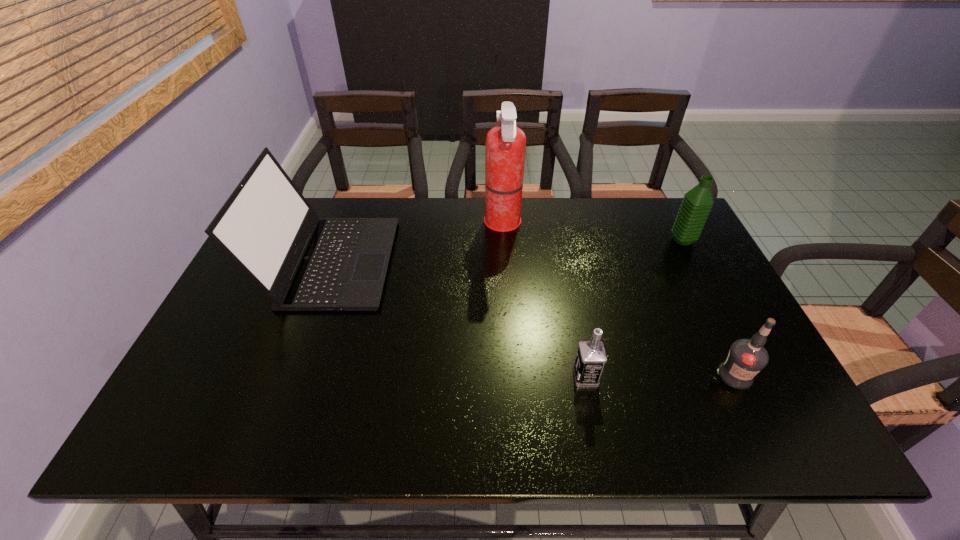
Find the location of a particular element. free space located with the handle and hose on the second object from left to right is located at coordinates (390, 224).

Find the location of a particular element. Image resolution: width=960 pixels, height=540 pixels. vacant space located 0.250m on the surface of the leftmost object is located at coordinates (477, 262).

Where is `free location located 0.360m on the front of the water bottle`? The height and width of the screenshot is (540, 960). free location located 0.360m on the front of the water bottle is located at coordinates (737, 345).

Find the location of a particular element. This screenshot has width=960, height=540. blank space located on the front label of the taller vodka is located at coordinates (758, 424).

At what (x,y) coordinates should I click in order to perform the action: click on free location located 0.320m on the front label of the left vodka. Please return your answer as a coordinate pair (x, y). Looking at the image, I should click on (432, 377).

Find the location of a particular element. Image resolution: width=960 pixels, height=540 pixels. vacant space located 0.050m on the front label of the left vodka is located at coordinates (552, 377).

Where is `vacant space positioned 0.260m on the front label of the left vodka`? The image size is (960, 540). vacant space positioned 0.260m on the front label of the left vodka is located at coordinates (459, 377).

The height and width of the screenshot is (540, 960). I want to click on fire extinguisher present at the far edge, so click(505, 148).

In order to click on laptop that is at the far edge in this screenshot , I will do `click(302, 262)`.

I want to click on water bottle at the far edge, so (x=697, y=203).